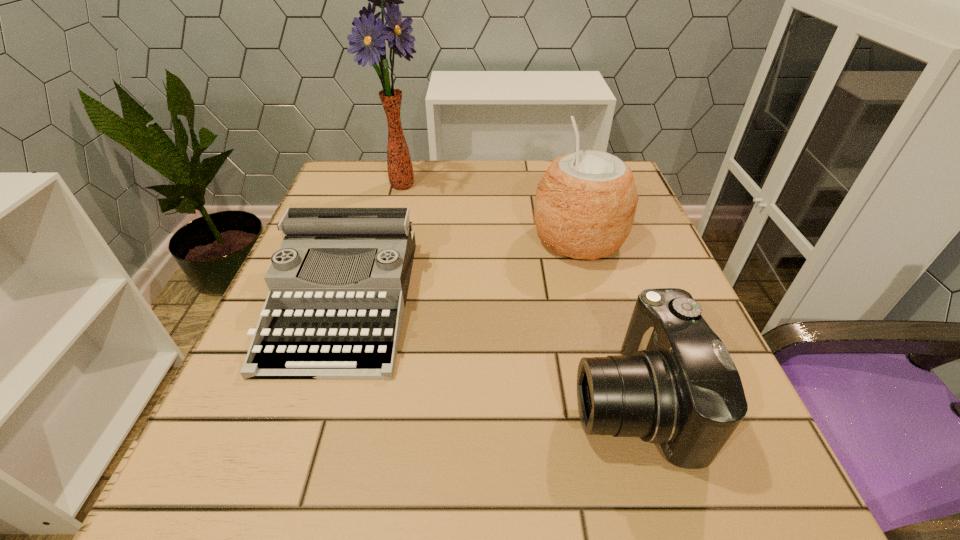
Identify the location of flower arrangement. (368, 39).

This screenshot has width=960, height=540. I want to click on the farthest object, so click(368, 39).

What are the coordinates of `coconut` in the screenshot? It's located at (585, 205).

Find the location of a particular element. The width and height of the screenshot is (960, 540). camera is located at coordinates (675, 384).

The image size is (960, 540). What are the coordinates of `the shortest object` in the screenshot? It's located at (338, 285).

Find the location of a particular element. This screenshot has width=960, height=540. vacant position located on the right of the farthest object is located at coordinates 577,184.

You are a GUI agent. You are given a task and a screenshot of the screen. Output one action in this format:
    pyautogui.click(x=<x>, y=<y>)
    Task: Click on the vacant space located on the right of the coconut
    Image resolution: width=960 pixels, height=540 pixels.
    Given the screenshot: What is the action you would take?
    pyautogui.click(x=654, y=240)

Where is `vacant area situated 0.280m on the lens of the camera`? This screenshot has height=540, width=960. vacant area situated 0.280m on the lens of the camera is located at coordinates (383, 400).

At what (x,y) coordinates should I click in order to perform the action: click on free space located 0.190m on the lens of the camera. Please return your answer as a coordinate pair (x, y). Image resolution: width=960 pixels, height=540 pixels. Looking at the image, I should click on (x=444, y=400).

The height and width of the screenshot is (540, 960). What are the coordinates of `free spot located on the lens of the camera` in the screenshot? It's located at (322, 400).